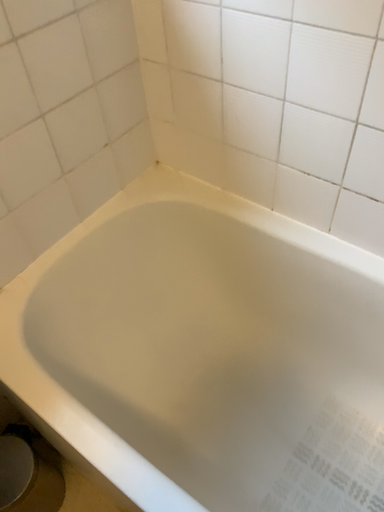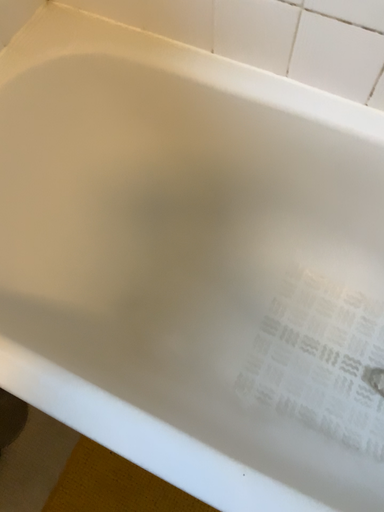
Question: How did the camera likely rotate when shooting the video?

Choices:
 (A) rotated upward
 (B) rotated downward

Answer: (B)